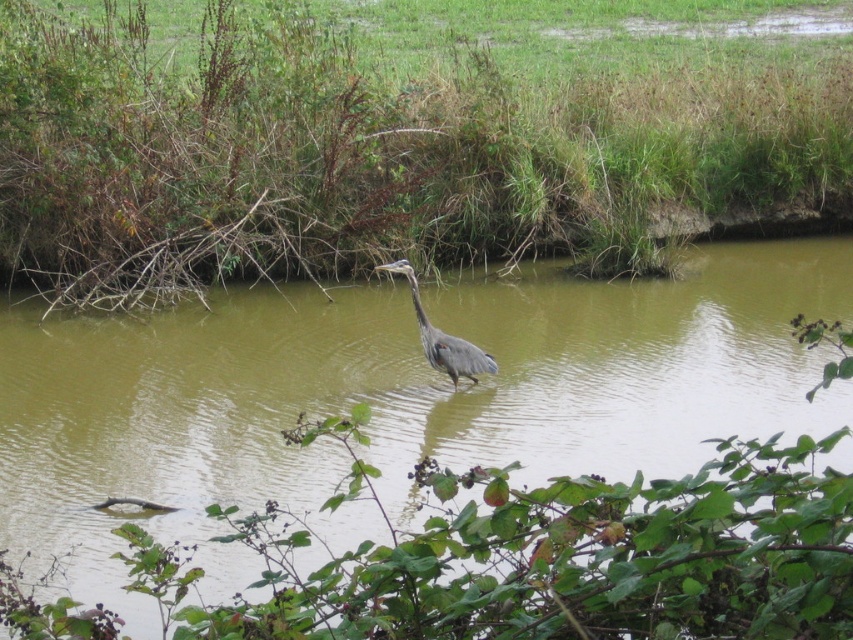
Question: Based on their relative distances, which object is nearer to the brown murky water at center?

Choices:
 (A) gray matte heron at center
 (B) green grass at center

Answer: (A)

Question: Does green grass at center appear over gray matte heron at center?

Choices:
 (A) yes
 (B) no

Answer: (A)

Question: Which of the following is the farthest from the observer?

Choices:
 (A) gray matte heron at center
 (B) brown murky water at center
 (C) green grass at center

Answer: (C)

Question: Does green grass at center have a smaller size compared to brown murky water at center?

Choices:
 (A) yes
 (B) no

Answer: (B)

Question: Is green grass at center above brown murky water at center?

Choices:
 (A) no
 (B) yes

Answer: (B)

Question: Considering the real-world distances, which object is closest to the brown murky water at center?

Choices:
 (A) gray matte heron at center
 (B) green grass at center

Answer: (A)